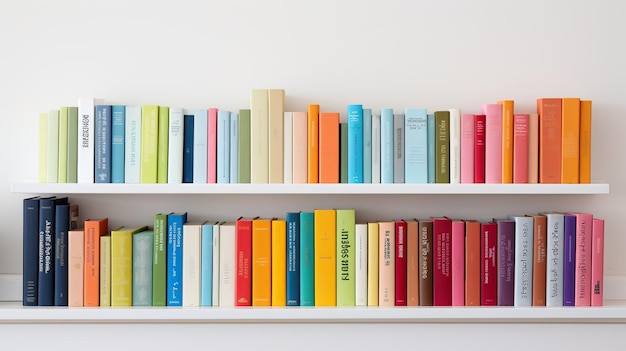
Identify the location of pink books. This screenshot has height=351, width=626. (598, 270), (585, 270), (456, 264), (469, 173), (489, 172), (518, 172), (211, 175), (77, 272).